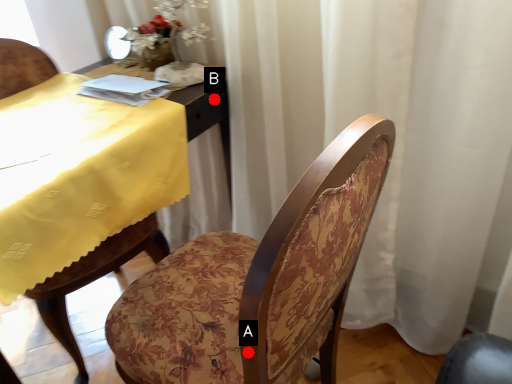
Question: Two points are circled on the image, labeled by A and B beside each circle. Which point is closer to the camera?

Choices:
 (A) A is closer
 (B) B is closer

Answer: (A)